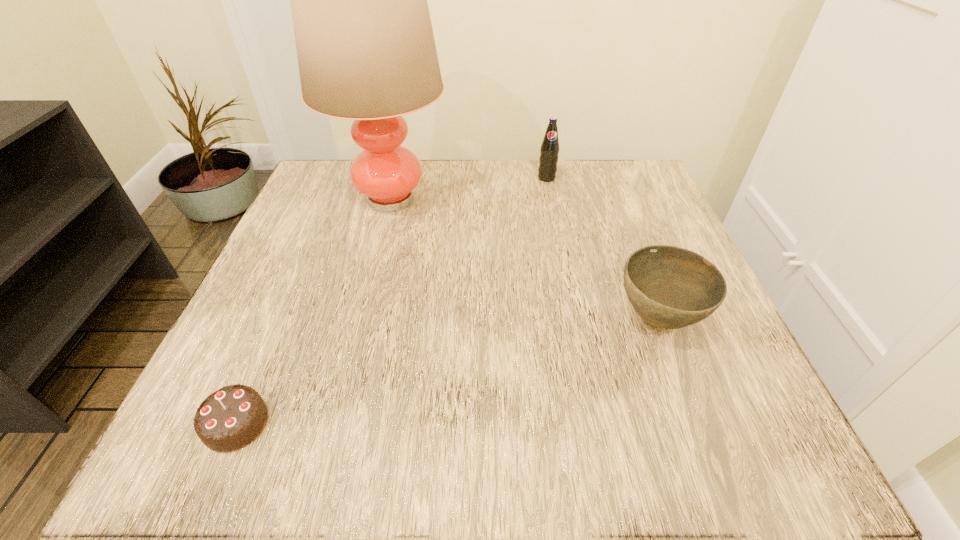
Image resolution: width=960 pixels, height=540 pixels. I want to click on vacant space at the near edge, so click(x=451, y=458).

Locate an element on the screen. This screenshot has width=960, height=540. vacant region at the left edge of the desktop is located at coordinates click(x=275, y=264).

The width and height of the screenshot is (960, 540). I want to click on vacant space at the right edge, so [x=620, y=261].

At what (x,y) coordinates should I click in order to perform the action: click on free space at the near left corner. Please return your answer as a coordinate pair (x, y). The image size is (960, 540). Looking at the image, I should click on (204, 458).

I want to click on free region at the far right corner of the desktop, so click(582, 173).

Locate an element on the screen. The image size is (960, 540). free spot between the pop and the tallest object is located at coordinates (469, 188).

I want to click on free point between the bowl and the third shortest object, so click(602, 248).

Where is `empty space that is in between the nearest object and the pop`? The image size is (960, 540). empty space that is in between the nearest object and the pop is located at coordinates (392, 301).

This screenshot has height=540, width=960. I want to click on free space between the nearest object and the second object from right to left, so click(392, 301).

The image size is (960, 540). I want to click on free space that is in between the rightmost object and the tallest object, so click(524, 259).